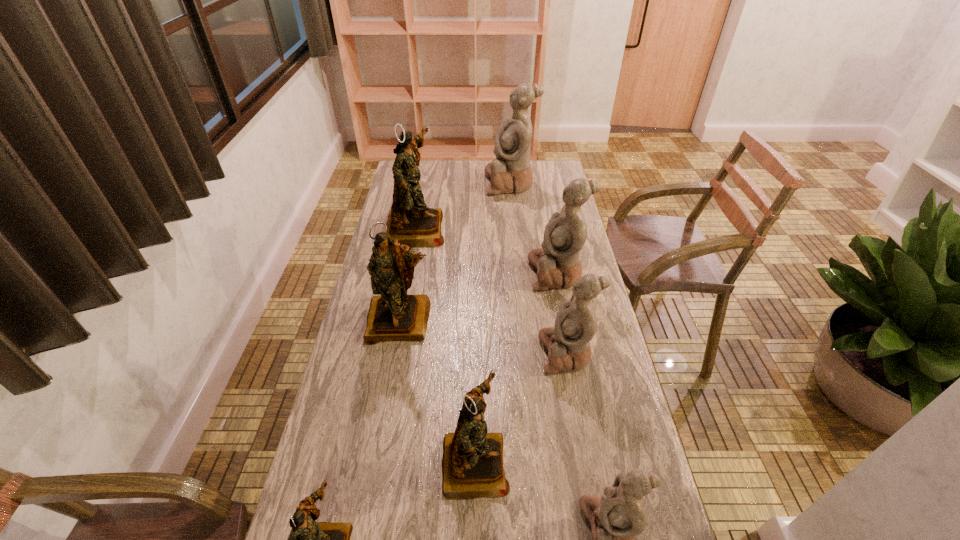
Locate an element on the screen. vacant space located on the front-facing side of the biggest white figurine is located at coordinates (407, 183).

Identify the location of blank space located 0.050m on the front-facing side of the biggest white figurine. (474, 183).

At what (x,y) coordinates should I click in order to perform the action: click on vacant space located on the front-facing side of the biggest white figurine. Please return your answer as a coordinate pair (x, y). The image size is (960, 540). Looking at the image, I should click on (416, 183).

Locate an element on the screen. The image size is (960, 540). free spot located 0.150m on the front-facing side of the seventh nearest figurine is located at coordinates (483, 228).

You are a GUI agent. You are given a task and a screenshot of the screen. Output one action in this format:
    pyautogui.click(x=<x>, y=<y>)
    Task: Click on the free space located 0.280m on the front-facing side of the second farthest white figurine
    This screenshot has height=540, width=960.
    Given the screenshot: What is the action you would take?
    pyautogui.click(x=451, y=274)

Where is `vacant space located on the front-facing side of the second farthest white figurine`? Image resolution: width=960 pixels, height=540 pixels. vacant space located on the front-facing side of the second farthest white figurine is located at coordinates (479, 274).

Where is `vacant region located on the front-facing side of the second farthest white figurine`? Image resolution: width=960 pixels, height=540 pixels. vacant region located on the front-facing side of the second farthest white figurine is located at coordinates (490, 274).

Find the location of a particular element. This screenshot has height=540, width=960. vacant space located on the front-facing side of the second farthest gold figurine is located at coordinates (385, 409).

Find the location of `free space located 0.270m on the front-facing side of the rightmost gold figurine`. free space located 0.270m on the front-facing side of the rightmost gold figurine is located at coordinates (619, 462).

I want to click on vacant area situated on the front-facing side of the third biggest white figurine, so 490,353.